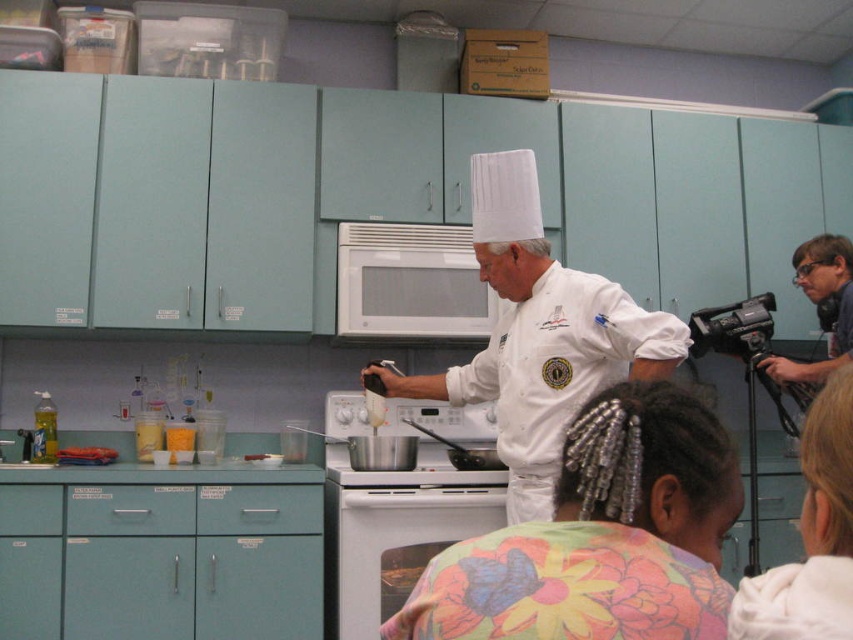
You are standing in a kitchen and see a point at coordinates (811, 536). According to the scene, where is this point located?

The point at coordinates (811, 536) is on the white hair at upper right.

You are standing in the kitchen and want to reach both the point at coordinates (726, 612) and the point at (335, 532). Which point should you reach for first to minimize the distance you walk?

You should reach for the point at coordinates (726, 612) first because it is closer to you than the point at (335, 532).